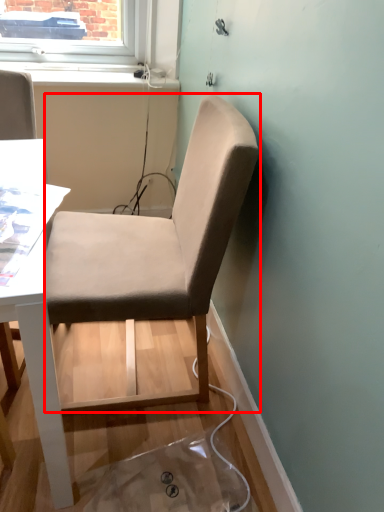
Question: From the image's perspective, what is the correct spatial relationship of chair (annotated by the red box) in relation to window sill?

Choices:
 (A) above
 (B) below

Answer: (B)